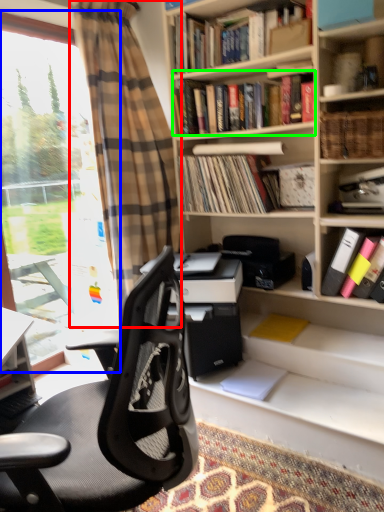
Question: Based on their relative distances, which object is nearer to curtain (highlighted by a red box)? Choose from window (highlighted by a blue box) and book (highlighted by a green box).

Choices:
 (A) window
 (B) book

Answer: (B)